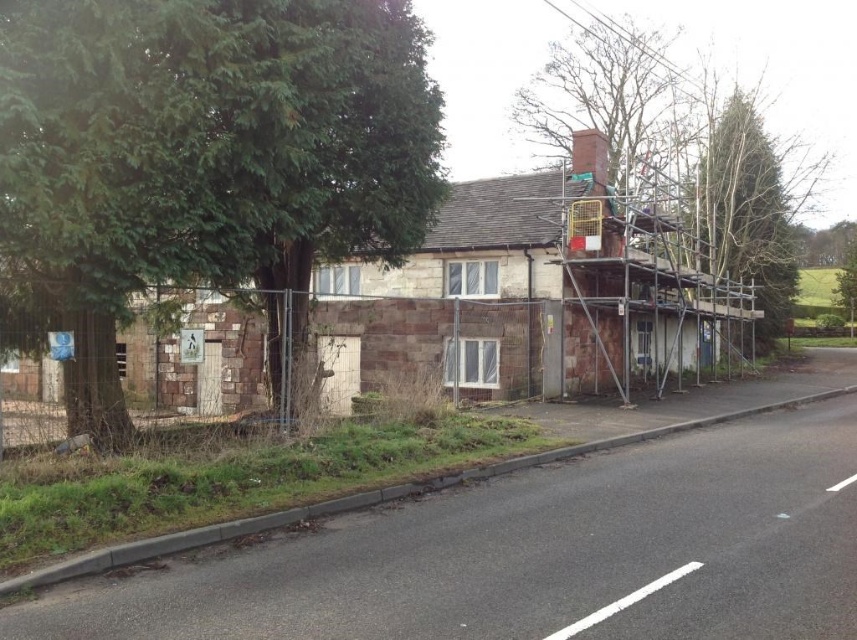
You are a painter standing at the entrance of the building. You need to paint the wall that has different stone texture and color. To do this, you must first determine which side of the building you should stand on. Based on the position of the green leafy tree at left and the bare branches at upper center, which side should you choose?

The green leafy tree at left is narrower than the bare branches at upper center. Therefore, you should stand on the side of the building where the green leafy tree at left is located, as it provides a narrower obstruction, making it easier to access the wall with the different stone texture and color.

You are a delivery person trying to park your van near the two story stone building. The van requires a parking spot that is 10 meters away from the green leafy tree at left. Is the parking spot available? Please explain your reasoning based on the scene description.

The scene description does not provide information about the distance between the two story stone building and the green leafy tree at left, so it is impossible to determine if the parking spot is available based on the given information.